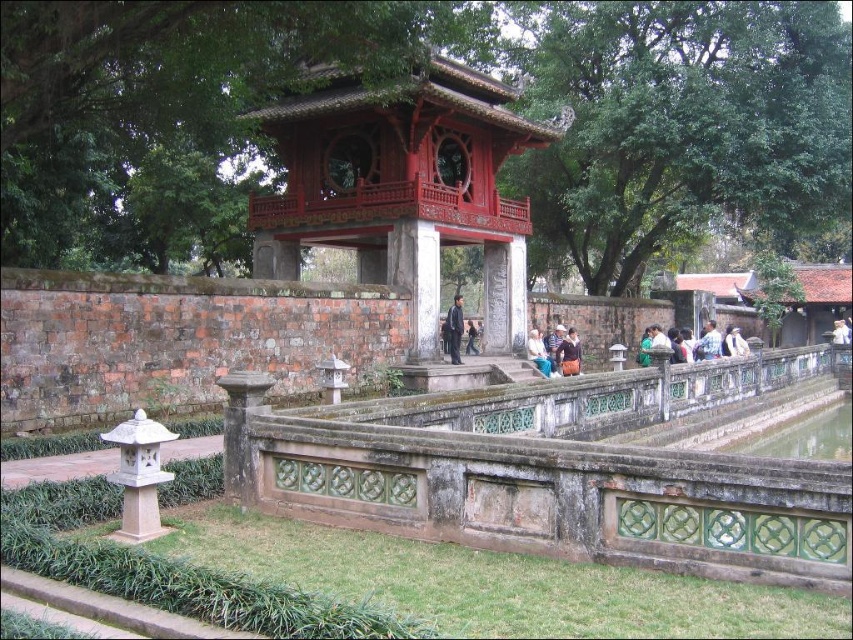
You are a visitor at the garden and see the white textured fabric at center and the blue fabric bag at center. Which one is positioned more to the right side?

The white textured fabric at center is positioned to the right of the blue fabric bag at center, so it is more to the right side.

What are the coordinates of the light blue shirt at lower right in the image?

The coordinates of the light blue shirt at lower right are at point (708, 342).

You are a visitor in the garden and see the shiny red gazebo at center and the brown leather jacket at lower right. Which object is closer to you?

The shiny red gazebo at center is closer to you because the brown leather jacket at lower right is behind it.